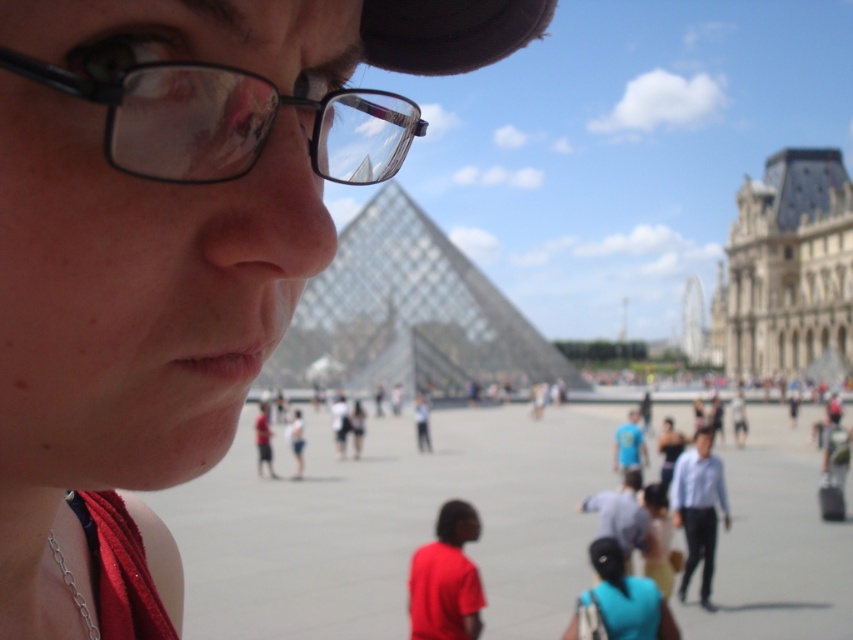
You are a photographer standing 100 feet away from the matte black glasses at center. You want to take a clear photo of them. Considering the distance, will the glasses be in focus if your camera has a maximum focus range of 150 feet?

The matte black glasses at center are 151.99 feet away from the camera. Since your camera can only focus up to 150 feet, the glasses will be slightly out of focus.

You are a photographer trying to capture a clear shot of the person wearing the matte black glasses at center and the black plastic glasses at upper left. Which pair of glasses appears taller in the photo?

The matte black glasses at center appears taller than the black plastic glasses at upper left in the photo because the matte black glasses at center has a greater height compared to the black plastic glasses at upper left.

You are trying to decide which pair of glasses to choose for a presentation. The matte black glasses at center and the black plastic glasses at upper left are options. Based on their size, which might be more comfortable for a long presentation?

The matte black glasses at center might be wider than black plastic glasses at upper left, so they could be more comfortable for a long presentation due to their larger size.